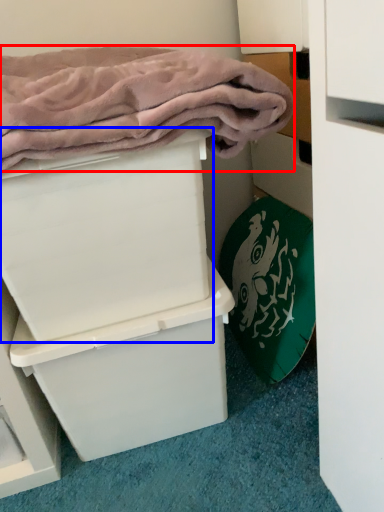
Question: Which of the following is the closest to the observer, bath towel (highlighted by a red box) or box (highlighted by a blue box)?

Choices:
 (A) bath towel
 (B) box

Answer: (A)